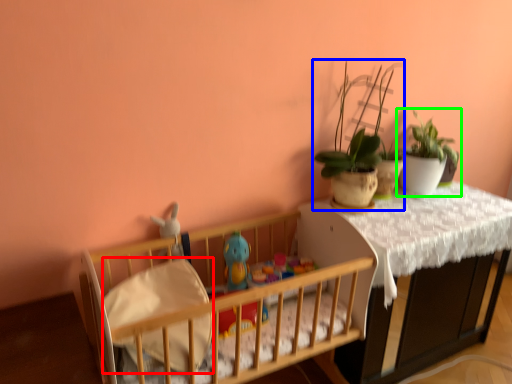
Question: Which is nearer to the sheet (highlighted by a red box)? houseplant (highlighted by a blue box) or houseplant (highlighted by a green box).

Choices:
 (A) houseplant
 (B) houseplant

Answer: (A)